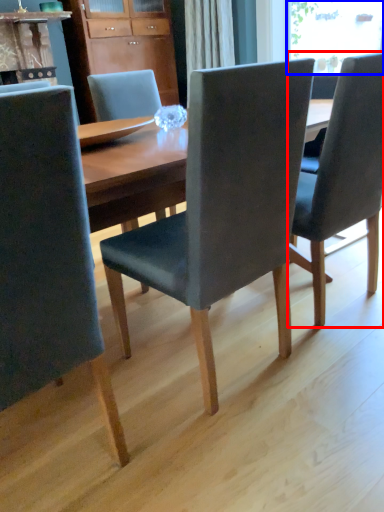
Question: Which object is closer to the camera taking this photo, chair (highlighted by a red box) or window screen (highlighted by a blue box)?

Choices:
 (A) chair
 (B) window screen

Answer: (A)